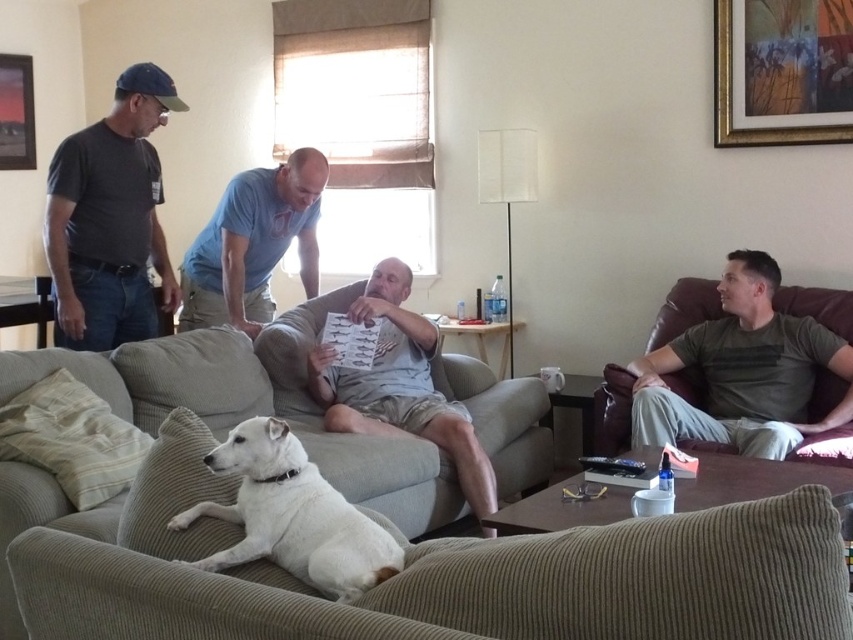
You are organizing a charity event and need to display items based on their size. You have a blue cotton shirt at center and a metallic picture frame at upper left. Which item should you place on the larger display stand?

The blue cotton shirt at center is bigger than the metallic picture frame at upper left, so it should be placed on the larger display stand.

You are a photographer setting up a shoot in this living room. You want to position a spotlight so that it illuminates the green cotton shirt at right without shining directly on the white fur dog at center. Based on their positions, is this possible?

The green cotton shirt at right is above the white fur dog at center, so positioning the spotlight above the shirt could illuminate it while avoiding the dog below.

You are a photographer positioned at the entrance of the living room. You want to take a photo of the green cotton shirt at right and the white fur dog at center without any obstruction. Should you move to your left or right to ensure both subjects are visible?

The white fur dog at center is behind the green cotton shirt at right, so moving to your left would position the photographer to see both subjects without obstruction.